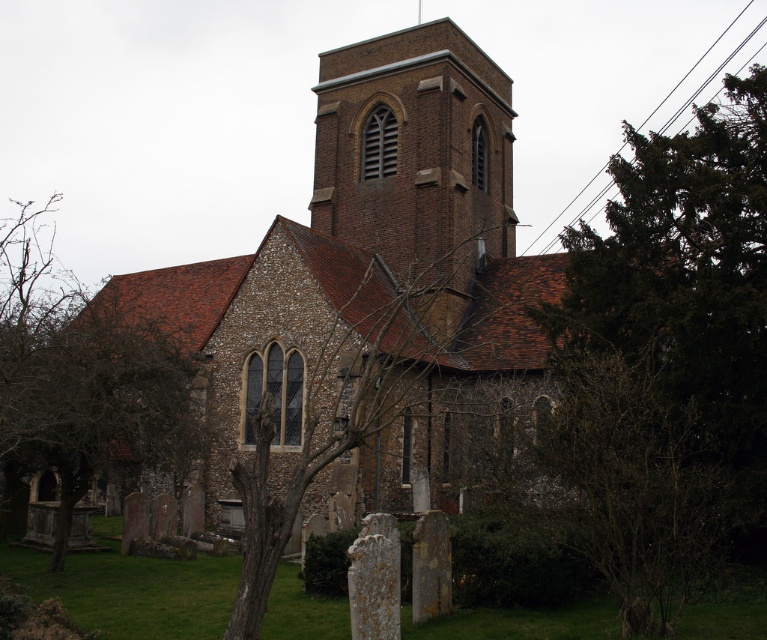
Question: Can you confirm if brown brick tower at center is positioned to the right of bare branches at center?

Choices:
 (A) no
 (B) yes

Answer: (B)

Question: Can you confirm if brown stone church at center is positioned to the left of green leafy tree at lower left?

Choices:
 (A) yes
 (B) no

Answer: (B)

Question: Which point appears closest to the camera in this image?

Choices:
 (A) (502, 225)
 (B) (153, 416)
 (C) (479, 317)

Answer: (B)

Question: Is the position of green leafy tree at lower left less distant than that of bare branches at center?

Choices:
 (A) no
 (B) yes

Answer: (A)

Question: Which point is closer to the camera taking this photo?

Choices:
 (A) (446, 52)
 (B) (331, 424)
 (C) (453, 180)

Answer: (B)

Question: Which point is farther from the camera taking this photo?

Choices:
 (A) (232, 296)
 (B) (7, 220)
 (C) (489, 106)
 (D) (259, 600)

Answer: (B)